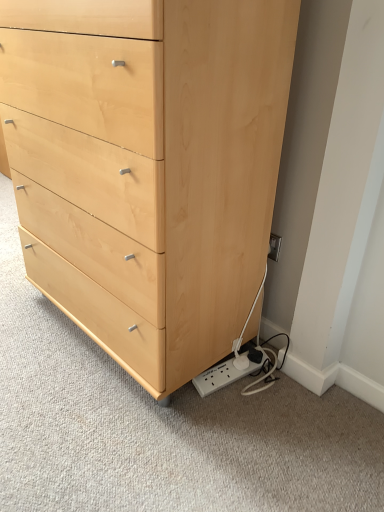
What is the approximate height of natural wood chest of drawers at lower left?

The height of natural wood chest of drawers at lower left is 1.07 meters.

The height and width of the screenshot is (512, 384). Describe the element at coordinates (148, 166) in the screenshot. I see `natural wood chest of drawers at lower left` at that location.

Where is `natural wood chest of drawers at lower left`? This screenshot has height=512, width=384. natural wood chest of drawers at lower left is located at coordinates (148, 166).

The image size is (384, 512). What do you see at coordinates (222, 376) in the screenshot?
I see `white plastic power strip at lower right` at bounding box center [222, 376].

Identify the location of white plastic power strip at lower right. This screenshot has height=512, width=384. (222, 376).

Locate an element on the screen. natural wood chest of drawers at lower left is located at coordinates (148, 166).

Does white plastic power strip at lower right appear on the left side of natural wood chest of drawers at lower left?

In fact, white plastic power strip at lower right is to the right of natural wood chest of drawers at lower left.

Does white plastic power strip at lower right lie behind natural wood chest of drawers at lower left?

That is True.

Does point (230, 381) appear closer or farther from the camera than point (96, 122)?

Point (230, 381) is farther from the camera than point (96, 122).

From the image's perspective, who appears lower, white plastic power strip at lower right or natural wood chest of drawers at lower left?

white plastic power strip at lower right appears lower in the image.

From a real-world perspective, is white plastic power strip at lower right physically located above or below natural wood chest of drawers at lower left?

white plastic power strip at lower right is below natural wood chest of drawers at lower left.

In terms of width, does white plastic power strip at lower right look wider or thinner when compared to natural wood chest of drawers at lower left?

In the image, white plastic power strip at lower right appears to be more narrow than natural wood chest of drawers at lower left.

Considering the sizes of objects white plastic power strip at lower right and natural wood chest of drawers at lower left in the image provided, who is taller, white plastic power strip at lower right or natural wood chest of drawers at lower left?

natural wood chest of drawers at lower left is taller.

Can you confirm if white plastic power strip at lower right is bigger than natural wood chest of drawers at lower left?

No, white plastic power strip at lower right is not bigger than natural wood chest of drawers at lower left.

From the picture: Could natural wood chest of drawers at lower left be considered to be inside white plastic power strip at lower right?

No.

Are white plastic power strip at lower right and natural wood chest of drawers at lower left far apart?

No, white plastic power strip at lower right is not far from natural wood chest of drawers at lower left.

Is white plastic power strip at lower right turned away from natural wood chest of drawers at lower left?

No.

Measure the distance between white plastic power strip at lower right and natural wood chest of drawers at lower left.

They are 23.52 inches apart.

At what (x,y) coordinates should I click in order to perform the action: click on chest of drawers in front of the white plastic power strip at lower right. Please return your answer as a coordinate pair (x, y). The width and height of the screenshot is (384, 512). Looking at the image, I should click on (148, 166).

Is natural wood chest of drawers at lower left to the right of white plastic power strip at lower right from the viewer's perspective?

In fact, natural wood chest of drawers at lower left is to the left of white plastic power strip at lower right.

Which object is closer to the camera, natural wood chest of drawers at lower left or white plastic power strip at lower right?

natural wood chest of drawers at lower left is in front.

Is point (159, 234) positioned after point (202, 380)?

No, (159, 234) is in front of (202, 380).

From the image's perspective, is natural wood chest of drawers at lower left above or below white plastic power strip at lower right?

From the image's perspective, natural wood chest of drawers at lower left appears above white plastic power strip at lower right.

From a real-world perspective, is natural wood chest of drawers at lower left under white plastic power strip at lower right?

No, from a real-world perspective, natural wood chest of drawers at lower left is not beneath white plastic power strip at lower right.

Between natural wood chest of drawers at lower left and white plastic power strip at lower right, which one has smaller width?

white plastic power strip at lower right is thinner.

Is natural wood chest of drawers at lower left shorter than white plastic power strip at lower right?

In fact, natural wood chest of drawers at lower left may be taller than white plastic power strip at lower right.

Who is bigger, natural wood chest of drawers at lower left or white plastic power strip at lower right?

With larger size is natural wood chest of drawers at lower left.

Is natural wood chest of drawers at lower left inside or outside of white plastic power strip at lower right?

natural wood chest of drawers at lower left is not enclosed by white plastic power strip at lower right.

Is natural wood chest of drawers at lower left far away from white plastic power strip at lower right?

That's not correct — natural wood chest of drawers at lower left is a little close to white plastic power strip at lower right.

Is natural wood chest of drawers at lower left positioned with its back to white plastic power strip at lower right?

No, white plastic power strip at lower right is not at the back of natural wood chest of drawers at lower left.

What's the angular difference between natural wood chest of drawers at lower left and white plastic power strip at lower right's facing directions?

The facing directions of natural wood chest of drawers at lower left and white plastic power strip at lower right are 10.7 degrees apart.

How much distance is there between natural wood chest of drawers at lower left and white plastic power strip at lower right?

A distance of 23.52 inches exists between natural wood chest of drawers at lower left and white plastic power strip at lower right.

The width and height of the screenshot is (384, 512). Identify the location of chest of drawers on the left side of white plastic power strip at lower right. (148, 166).

This screenshot has width=384, height=512. In order to click on the chest of drawers above the white plastic power strip at lower right (from a real-world perspective) in this screenshot , I will do `click(148, 166)`.

In the image, there is a natural wood chest of drawers at lower left. Where is `plug below it (from a real-world perspective)`? plug below it (from a real-world perspective) is located at coordinates (222, 376).